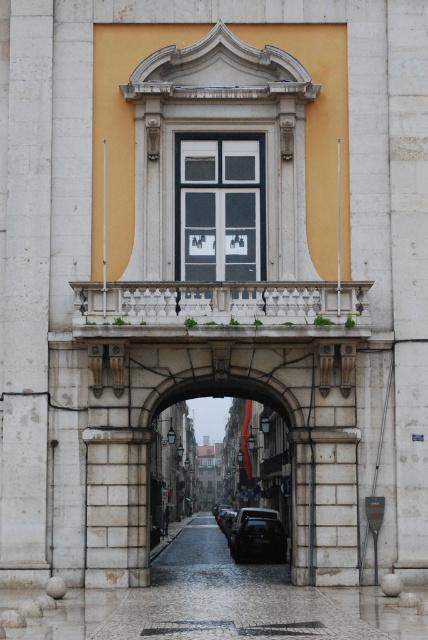
Based on the photo, you are an architect planning to install a new decorative banner between the matte glass window at center and the stone archway at center. Given their widths, which object should the banner be placed closer to to ensure it doesn not extend beyond either structure?

The matte glass window at center has a smaller width than the stone archway at center. To ensure the banner does not extend beyond either structure, it should be placed closer to the matte glass window at center since its narrower width requires the banner to be centered or aligned without overhang.

You are a photographer planning to take a wide shot of the historic stone archway at center and the shiny black car at center. Given the camera you have can capture a maximum width of 3 meters, will both objects fit in the frame if they are positioned side by side?

The stone archway at center is wider than the shiny black car at center. Since the camera can capture up to 3 meters, and the combined width of both objects would exceed this limit, they cannot both fit in the frame side by side.